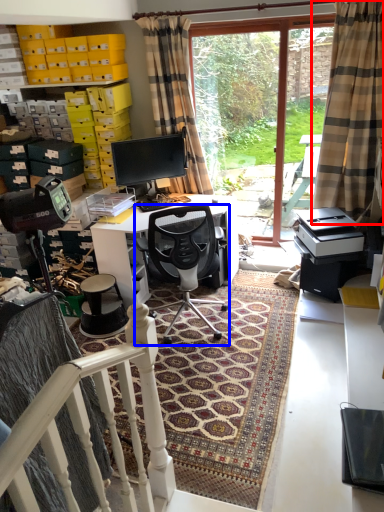
Question: Which of the following is the closest to the observer, curtain (highlighted by a red box) or chair (highlighted by a blue box)?

Choices:
 (A) curtain
 (B) chair

Answer: (A)